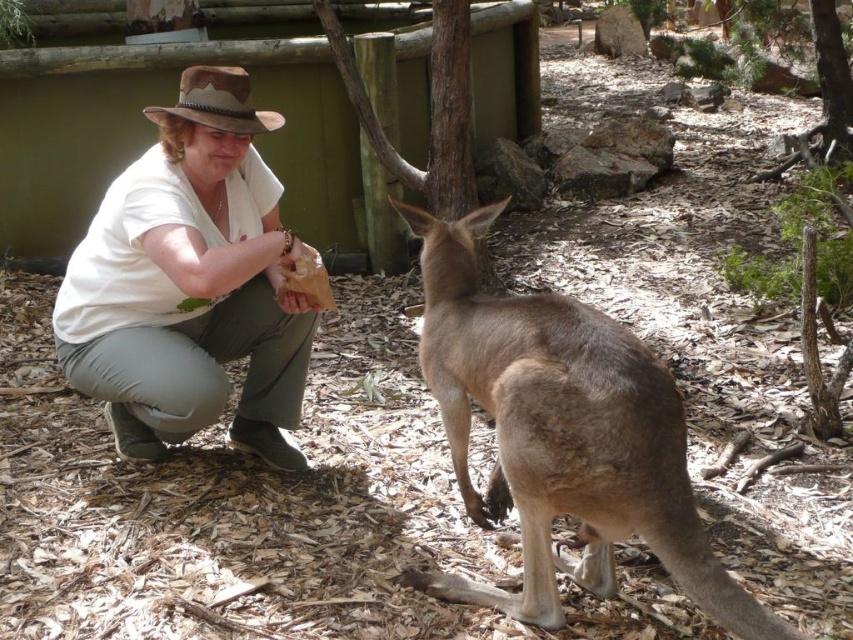
You are a zookeeper observing the scene. The brown furry kangaroo at center and the white cotton shirt at center are in your line of sight. Which object is closer to you?

The brown furry kangaroo at center is closer to you since it is in front of the white cotton shirt at center.

You are a zookeeper observing the scene. You need to determine if the brown furry kangaroo at center can fit under a low hanging branch that is at the same height as the white cotton shirt at center. Can it?

The brown furry kangaroo at center is shorter than the white cotton shirt at center. Since the branch is at the same height as the white cotton shirt at center, the kangaroo can fit under the branch without issue.